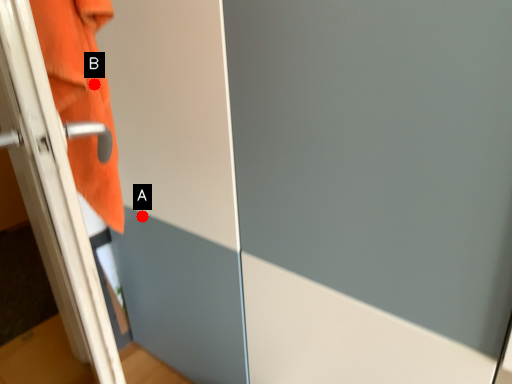
Question: Two points are circled on the image, labeled by A and B beside each circle. Which point appears farthest from the camera in this image?

Choices:
 (A) A is further
 (B) B is further

Answer: (A)